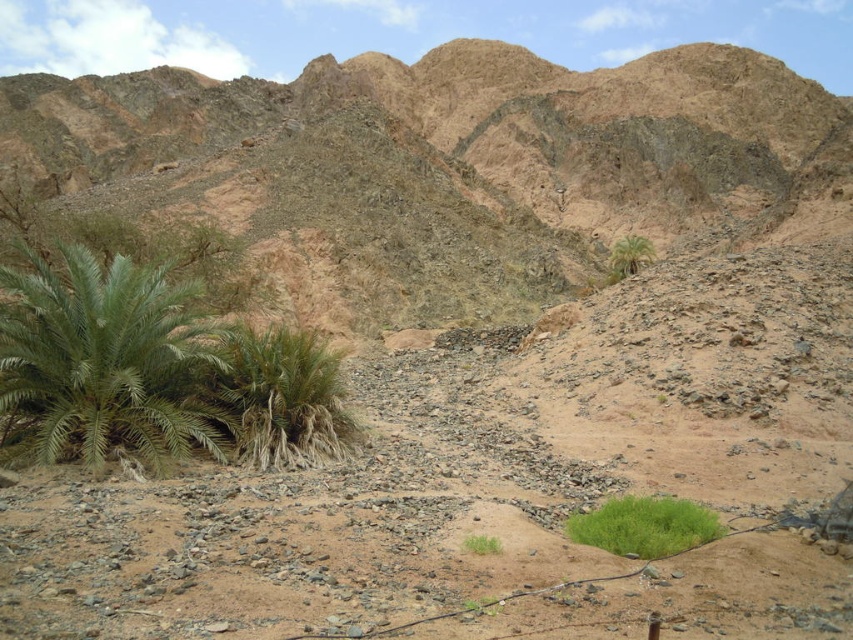
You are standing in the desert scene and want to move from the point at coordinates point [132,422] to the point at coordinates point [579,522]. Which direction should you face to walk towards the second point?

Since point [132,422] is closer to the camera than point [579,522], you should face towards the lower right direction to walk towards the second point.

You are a hiker trying to navigate through the desert. You see the green leafy palm at lower left and the green grass at center. Which one is taller?

The green leafy palm at lower left is much taller than the green grass at center.